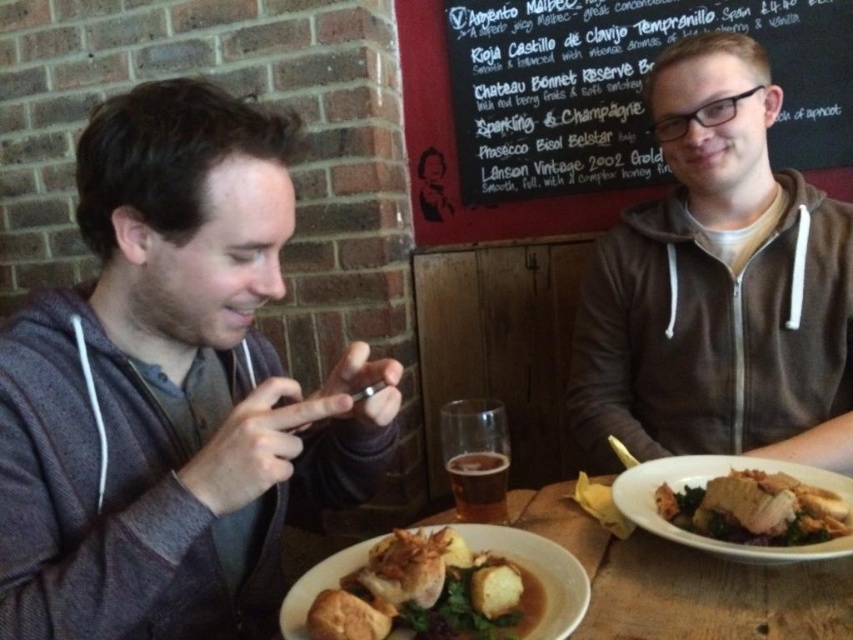
Question: Which object appears closest to the camera in this image?

Choices:
 (A) golden brown crusty bread at center
 (B) brown matte glass at center
 (C) brown zip-up hoodie at right
 (D) golden brown crispy chicken at right

Answer: (A)

Question: Is golden brown crusty bread at center below brown matte glass at center?

Choices:
 (A) no
 (B) yes

Answer: (B)

Question: Which of the following is the closest to the observer?

Choices:
 (A) black chalkboard at upper center
 (B) brown zip-up hoodie at right
 (C) gray hoodie at left
 (D) golden brown crispy chicken at right

Answer: (C)

Question: Which object is closer to the camera taking this photo?

Choices:
 (A) brown matte glass at center
 (B) black chalkboard at upper center
 (C) brown zip-up hoodie at right

Answer: (A)

Question: Is gray hoodie at left closer to camera compared to black chalkboard at upper center?

Choices:
 (A) no
 (B) yes

Answer: (B)

Question: From the image, what is the correct spatial relationship of black chalkboard at upper center in relation to brown matte glass at center?

Choices:
 (A) left
 (B) right

Answer: (B)